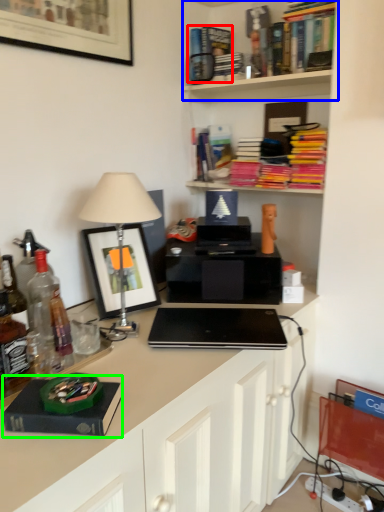
Question: Which object is the farthest from book (highlighted by a red box)? Choose among these: shelf (highlighted by a blue box) or paperback book (highlighted by a green box).

Choices:
 (A) shelf
 (B) paperback book

Answer: (B)